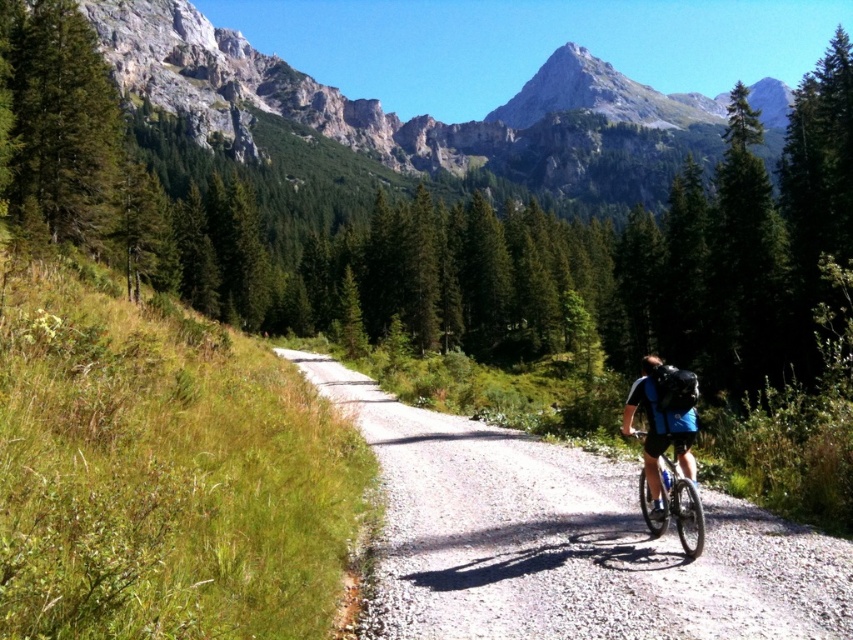
Is gravel road at center above rugged stone mountain at upper center?

No, gravel road at center is not above rugged stone mountain at upper center.

Does gravel road at center appear on the left side of rugged stone mountain at upper center?

Yes, gravel road at center is to the left of rugged stone mountain at upper center.

Where is `gravel road at center`? The image size is (853, 640). gravel road at center is located at coordinates (566, 540).

Who is lower down, gravel road at center or blue matte mountain bike at center?

gravel road at center is below.

Who is more forward, (x=381, y=538) or (x=665, y=467)?

Point (x=665, y=467) is more forward.

Where is `gravel road at center`? The height and width of the screenshot is (640, 853). gravel road at center is located at coordinates (566, 540).

Which is above, rugged stone mountain at upper center or matte black helmet at center?

rugged stone mountain at upper center

Does rugged stone mountain at upper center have a lesser height compared to matte black helmet at center?

No.

Image resolution: width=853 pixels, height=640 pixels. Identify the location of rugged stone mountain at upper center. (416, 115).

At what (x,y) coordinates should I click in order to perform the action: click on rugged stone mountain at upper center. Please return your answer as a coordinate pair (x, y). The height and width of the screenshot is (640, 853). Looking at the image, I should click on (416, 115).